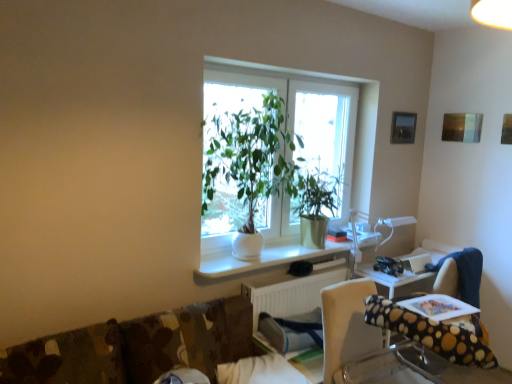
Find the location of `white glossy computer desk at center`. white glossy computer desk at center is located at coordinates (260, 255).

Image resolution: width=512 pixels, height=384 pixels. Describe the element at coordinates (317, 190) in the screenshot. I see `green matte plant at center` at that location.

The height and width of the screenshot is (384, 512). In order to click on polka dot fabric chair at lower right in this screenshot , I will do `click(376, 346)`.

Where is `white plastic radiator at lower center`? The height and width of the screenshot is (384, 512). white plastic radiator at lower center is located at coordinates (x=292, y=290).

What do you see at coordinates (292, 290) in the screenshot? The image size is (512, 384). I see `white plastic radiator at lower center` at bounding box center [292, 290].

The image size is (512, 384). I want to click on white ceramic plant at center, so click(x=249, y=164).

Looking at this image, which of these two, white glossy computer desk at center or white ceramic plant at center, is smaller?

white glossy computer desk at center.

From the image's perspective, which object appears higher, white glossy computer desk at center or white ceramic plant at center?

white ceramic plant at center, from the image's perspective.

Is there a large distance between metallic silver picture frame at upper right and white glossy computer desk at center?

Yes, metallic silver picture frame at upper right and white glossy computer desk at center are quite far apart.

From the image's perspective, which is below, metallic silver picture frame at upper right or white glossy computer desk at center?

white glossy computer desk at center, from the image's perspective.

Which of these two, metallic silver picture frame at upper right or white glossy computer desk at center, stands taller?

Standing taller between the two is metallic silver picture frame at upper right.

Find the location of a particular element. This screenshot has width=512, height=384. computer desk that appears in front of the metallic silver picture frame at upper right is located at coordinates (260, 255).

Does white ceramic plant at center have a lesser width compared to white glossy computer desk at center?

No, white ceramic plant at center is not thinner than white glossy computer desk at center.

Is white ceramic plant at center bigger or smaller than white glossy computer desk at center?

Considering their sizes, white ceramic plant at center takes up more space than white glossy computer desk at center.

Could you tell me if white ceramic plant at center is facing white glossy computer desk at center?

No, white ceramic plant at center is not aimed at white glossy computer desk at center.

From a real-world perspective, which object stands above the other?

From a 3D spatial view, white ceramic plant at center is above.

This screenshot has width=512, height=384. What are the coordinates of `computer desk located in front of the white plastic radiator at lower center` in the screenshot? It's located at (260, 255).

Is white plastic radiator at lower center a part of white glossy computer desk at center?

No, white plastic radiator at lower center is located outside of white glossy computer desk at center.

Who is bigger, white glossy computer desk at center or white plastic radiator at lower center?

With larger size is white plastic radiator at lower center.

Is white glossy computer desk at center bigger or smaller than metallic silver picture frame at upper right?

Clearly, white glossy computer desk at center is larger in size than metallic silver picture frame at upper right.

Could you tell me if white glossy computer desk at center is turned towards metallic silver picture frame at upper right?

No, white glossy computer desk at center is not oriented towards metallic silver picture frame at upper right.

Is white glossy computer desk at center taller or shorter than metallic silver picture frame at upper right?

white glossy computer desk at center is shorter than metallic silver picture frame at upper right.

Which object is positioned more to the left, white glossy computer desk at center or metallic silver picture frame at upper right?

From the viewer's perspective, white glossy computer desk at center appears more on the left side.

Looking at this image, from a real-world perspective, is white glossy computer desk at center beneath polka dot fabric chair at lower right?

Actually, white glossy computer desk at center is physically above polka dot fabric chair at lower right in the real world.

Can you confirm if white glossy computer desk at center is positioned to the left of polka dot fabric chair at lower right?

Yes.

Can you see white glossy computer desk at center touching polka dot fabric chair at lower right?

There is a gap between white glossy computer desk at center and polka dot fabric chair at lower right.

Is white glossy computer desk at center in front of or behind polka dot fabric chair at lower right in the image?

Clearly, white glossy computer desk at center is behind polka dot fabric chair at lower right.

From the image's perspective, is white plastic radiator at lower center on top of white ceramic plant at center?

No, from the image's perspective, white plastic radiator at lower center is not over white ceramic plant at center.

Does white plastic radiator at lower center have a greater width compared to white ceramic plant at center?

No, white plastic radiator at lower center is not wider than white ceramic plant at center.

Is white plastic radiator at lower center with white ceramic plant at center?

There is a gap between white plastic radiator at lower center and white ceramic plant at center.

Which is closer to the camera, [251,288] or [265,154]?

The point [265,154] is more forward.

Find the location of a particular element. computer desk below the white ceramic plant at center (from a real-world perspective) is located at coordinates (260, 255).

Find the location of a particular element. The image size is (512, 384). picture frame on the right of white glossy computer desk at center is located at coordinates (403, 128).

Estimate the real-world distances between objects in this image. Which object is closer to white glossy computer desk at center, polka dot fabric chair at lower right or green matte plant at center?

green matte plant at center.

Considering their positions, is metallic silver picture frame at upper right positioned further to green matte plant at center than white glossy computer desk at center?

metallic silver picture frame at upper right lies further to green matte plant at center than the other object.

Based on their spatial positions, is metallic silver picture frame at upper right or green matte plant at center closer to white ceramic plant at center?

Among the two, green matte plant at center is located nearer to white ceramic plant at center.

Considering their positions, is white plastic radiator at lower center positioned closer to metallic silver picture frame at upper right than white ceramic plant at center?

The object closer to metallic silver picture frame at upper right is white ceramic plant at center.

Estimate the real-world distances between objects in this image. Which object is further from white plastic radiator at lower center, metallic silver picture frame at upper right or polka dot fabric chair at lower right?

metallic silver picture frame at upper right.

When comparing their distances from white glossy computer desk at center, does white ceramic plant at center or metallic silver picture frame at upper right seem closer?

Based on the image, white ceramic plant at center appears to be nearer to white glossy computer desk at center.

Which object lies further to the anchor point metallic silver picture frame at upper right, green matte plant at center or polka dot fabric chair at lower right?

polka dot fabric chair at lower right.

From the image, which object appears to be farther from polka dot fabric chair at lower right, metallic silver picture frame at upper right or white plastic radiator at lower center?

metallic silver picture frame at upper right lies further to polka dot fabric chair at lower right than the other object.

Identify the location of vegetation between polka dot fabric chair at lower right and metallic silver picture frame at upper right from front to back. The width and height of the screenshot is (512, 384). (317, 190).

Locate an element on the screen. The height and width of the screenshot is (384, 512). vegetation between metallic silver picture frame at upper right and white plastic radiator at lower center from top to bottom is located at coordinates (317, 190).

Identify the location of vegetation between white ceramic plant at center and white plastic radiator at lower center in the vertical direction. (317, 190).

This screenshot has height=384, width=512. I want to click on computer desk positioned between white ceramic plant at center and green matte plant at center from near to far, so click(260, 255).